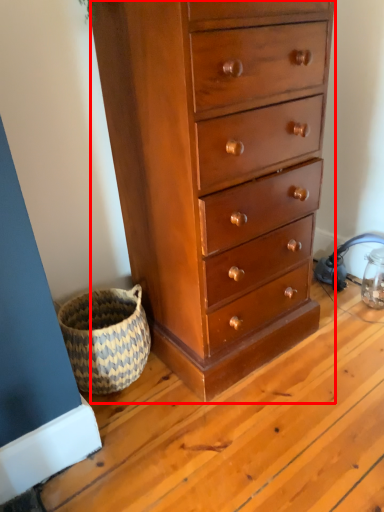
Question: From the image, what is the correct spatial relationship of chest of drawers (annotated by the red box) in relation to basket?

Choices:
 (A) right
 (B) left

Answer: (A)